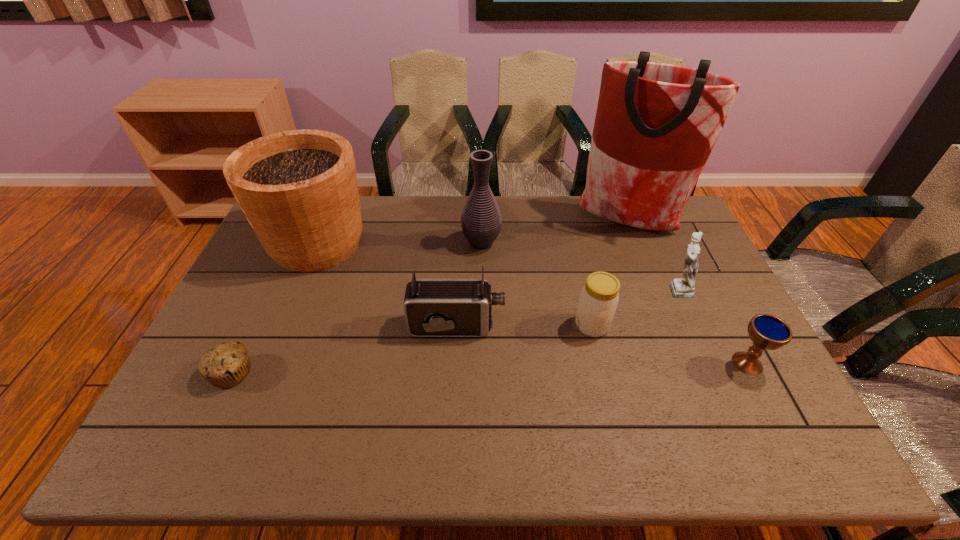
The height and width of the screenshot is (540, 960). I want to click on flowerpot located in the far edge section of the desktop, so click(298, 189).

At what (x,y) coordinates should I click in order to perform the action: click on flowerpot present at the left edge. Please return your answer as a coordinate pair (x, y). Looking at the image, I should click on (298, 189).

The height and width of the screenshot is (540, 960). In order to click on muffin positioned at the left edge in this screenshot , I will do `click(227, 364)`.

The image size is (960, 540). I want to click on grocery bag positioned at the right edge, so click(656, 124).

You are a GUI agent. You are given a task and a screenshot of the screen. Output one action in this format:
    pyautogui.click(x=<x>, y=<y>)
    Task: Click on the figurine positioned at the right edge
    The image size is (960, 540).
    Given the screenshot: What is the action you would take?
    tap(683, 288)

At what (x,y) coordinates should I click in order to perform the action: click on chalice situated at the right edge. Please return your answer as a coordinate pair (x, y). Looking at the image, I should click on (766, 331).

This screenshot has width=960, height=540. What are the coordinates of `object positioned at the far left corner` in the screenshot? It's located at (298, 189).

Find the location of a particular element. This screenshot has height=540, width=960. object positioned at the far right corner is located at coordinates (656, 124).

Where is `free spot at the far edge of the desktop`? This screenshot has height=540, width=960. free spot at the far edge of the desktop is located at coordinates (569, 212).

In the image, there is a desktop. At what (x,y) coordinates should I click in order to perform the action: click on vacant space at the near edge. Please return your answer as a coordinate pair (x, y). The image size is (960, 540). Looking at the image, I should click on (294, 448).